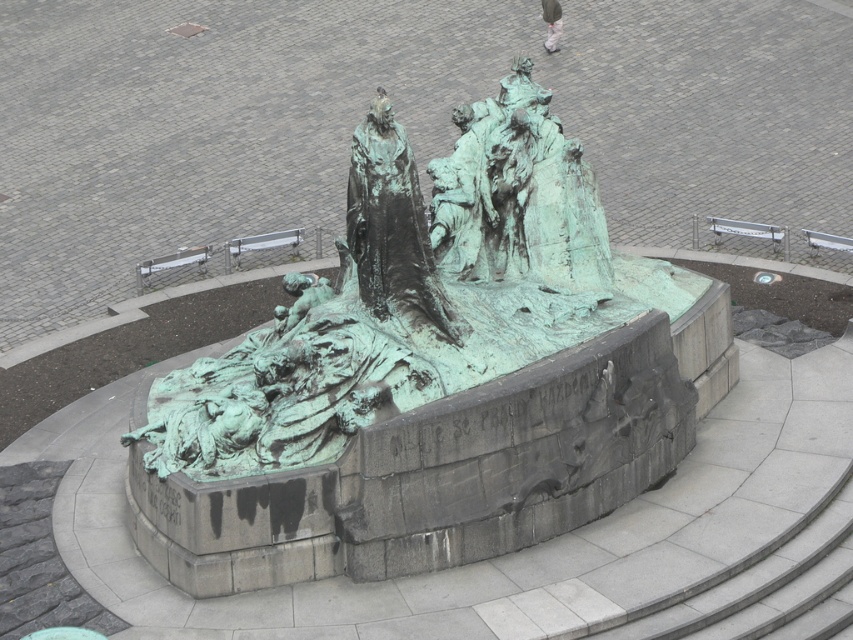
You are an art conservator planning to move the green patina sculpture at center and the green patina statue at center to a museum. The museum has a loading dock that can accommodate objects up to 7 feet apart. Can both objects be transported together without exceeding the dock width?

The distance between the green patina sculpture at center and the green patina statue at center is 6.61 feet, which is under the 7 feet limit. Therefore, they can be transported together without exceeding the dock width.

You are standing in the public square facing the bronze sculpture. You notice two points marked on the sculpture base. The first point is at coordinate (445, 369) and the second at (405, 253). From your perspective, which point is closer to you?

Point (445, 369) is in front of point (405, 253), so it is closer to you.

You are a city planner assessing the placement of a new bench. The bench will be placed exactly halfway between the green patina sculpture at center and another landmark 18.31 meters away. If the bench is 1.5 meters long, will it fit perfectly between them without overlapping either?

The distance between the green patina sculpture at center and the other landmark is 18.31 meters. Half of this distance is 9.155 meters. Placing the bench halfway would mean it is 9.155 meters from each, but the bench itself is only 1.5 meters long. Since 1.5 meters is much shorter than 9.155 meters, the bench will fit perfectly between them without overlapping either.